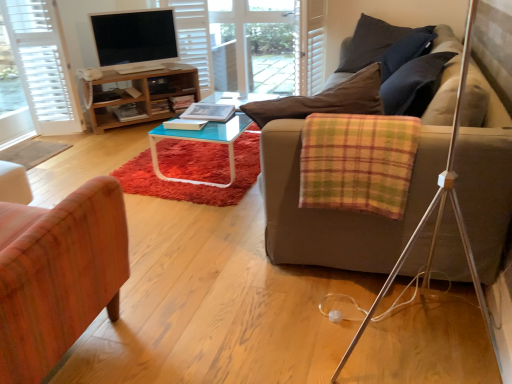
Question: From the image's perspective, is dark blue fabric pillow at upper right on top of wooden chair at left?

Choices:
 (A) yes
 (B) no

Answer: (A)

Question: Can you confirm if dark blue fabric pillow at upper right is bigger than wooden chair at left?

Choices:
 (A) no
 (B) yes

Answer: (A)

Question: Would you say dark blue fabric pillow at upper right is outside wooden chair at left?

Choices:
 (A) yes
 (B) no

Answer: (A)

Question: Could you tell me if dark blue fabric pillow at upper right is facing wooden chair at left?

Choices:
 (A) yes
 (B) no

Answer: (A)

Question: Does dark blue fabric pillow at upper right have a greater width compared to wooden chair at left?

Choices:
 (A) no
 (B) yes

Answer: (A)

Question: Considering the positions of plaid fabric blanket at right and matte black tv at upper left in the image, is plaid fabric blanket at right wider or thinner than matte black tv at upper left?

Choices:
 (A) wide
 (B) thin

Answer: (A)

Question: Choose the correct answer: Is plaid fabric blanket at right inside matte black tv at upper left or outside it?

Choices:
 (A) inside
 (B) outside

Answer: (B)

Question: Does point (396, 127) appear closer or farther from the camera than point (104, 34)?

Choices:
 (A) closer
 (B) farther

Answer: (A)

Question: In the image, is plaid fabric blanket at right positioned in front of or behind matte black tv at upper left?

Choices:
 (A) front
 (B) behind

Answer: (A)

Question: Would you say plaid fabric blanket at right is to the left or to the right of wooden chair at left in the picture?

Choices:
 (A) left
 (B) right

Answer: (B)

Question: Based on their sizes in the image, would you say plaid fabric blanket at right is bigger or smaller than wooden chair at left?

Choices:
 (A) big
 (B) small

Answer: (B)

Question: Is point (320, 145) closer or farther from the camera than point (84, 258)?

Choices:
 (A) closer
 (B) farther

Answer: (B)

Question: Is plaid fabric blanket at right in front of or behind wooden chair at left in the image?

Choices:
 (A) front
 (B) behind

Answer: (B)

Question: Visually, is hardcover book at center, arranged as the first book when viewed from the front, positioned to the left or to the right of transparent glass door at center?

Choices:
 (A) right
 (B) left

Answer: (B)

Question: Is hardcover book at center, arranged as the first book when viewed from the front, inside or outside of transparent glass door at center?

Choices:
 (A) outside
 (B) inside

Answer: (A)